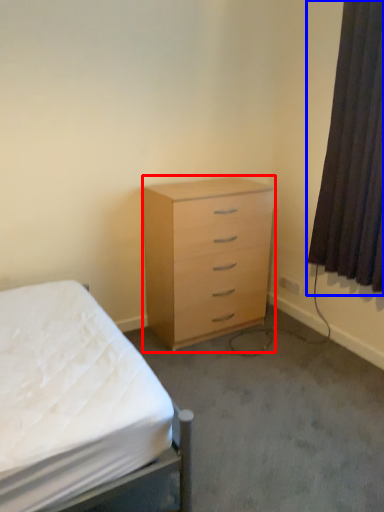
Question: Among these objects, which one is nearest to the camera, chest of drawers (highlighted by a red box) or curtain (highlighted by a blue box)?

Choices:
 (A) chest of drawers
 (B) curtain

Answer: (B)